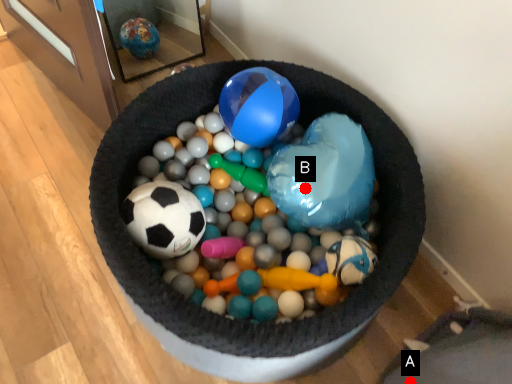
Question: Two points are circled on the image, labeled by A and B beside each circle. Which point is closer to the camera?

Choices:
 (A) A is closer
 (B) B is closer

Answer: (A)